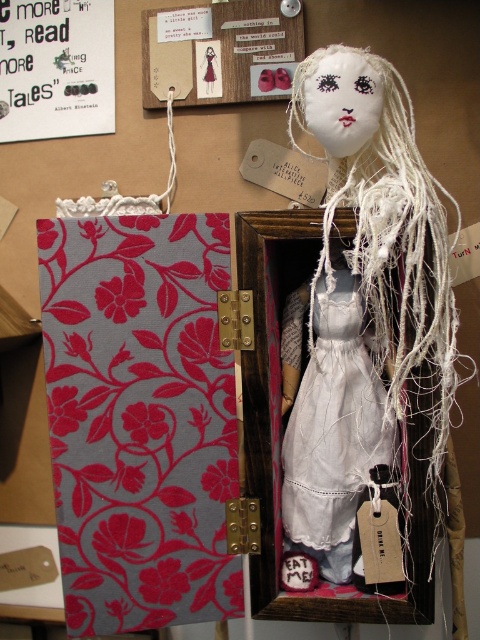
Is floral fabric book at center smaller than white cotton dress at center?

Yes, floral fabric book at center is smaller than white cotton dress at center.

This screenshot has height=640, width=480. Describe the element at coordinates (140, 419) in the screenshot. I see `floral fabric book at center` at that location.

This screenshot has height=640, width=480. Identify the location of floral fabric book at center. (140, 419).

Can you confirm if white fabric doll at center is positioned to the right of white cotton dress at center?

Yes, white fabric doll at center is to the right of white cotton dress at center.

Does white fabric doll at center have a smaller size compared to white cotton dress at center?

Incorrect, white fabric doll at center is not smaller in size than white cotton dress at center.

Is point (339, 376) closer to camera compared to point (359, 486)?

That is False.

Locate an element on the screen. The height and width of the screenshot is (640, 480). white fabric doll at center is located at coordinates pyautogui.click(x=363, y=301).

You are a GUI agent. You are given a task and a screenshot of the screen. Output one action in this format:
    pyautogui.click(x=<x>, y=<y>)
    Task: Click on the floral fabric book at center
    Image resolution: width=480 pixels, height=640 pixels.
    Given the screenshot: What is the action you would take?
    pyautogui.click(x=140, y=419)

Can you confirm if floral fabric book at center is positioned to the right of white fabric doll at center?

Incorrect, floral fabric book at center is not on the right side of white fabric doll at center.

Between point (158, 234) and point (412, 131), which one is positioned behind?

The point (412, 131) is behind.

The width and height of the screenshot is (480, 640). Find the location of `floral fabric book at center`. floral fabric book at center is located at coordinates (140, 419).